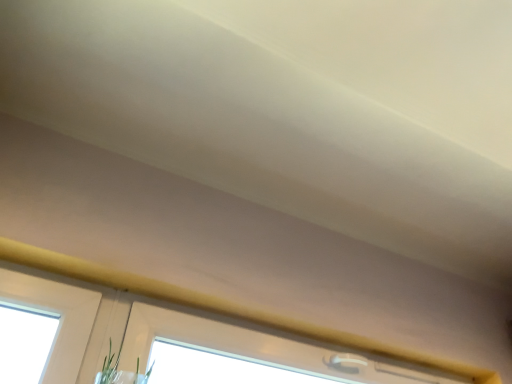
Question: From the image's perspective, is white plastic window at upper center below green matte plant at lower center?

Choices:
 (A) yes
 (B) no

Answer: (B)

Question: Does white plastic window at upper center lie behind green matte plant at lower center?

Choices:
 (A) yes
 (B) no

Answer: (A)

Question: Is white plastic window at upper center facing away from green matte plant at lower center?

Choices:
 (A) no
 (B) yes

Answer: (A)

Question: Does white plastic window at upper center have a greater height compared to green matte plant at lower center?

Choices:
 (A) yes
 (B) no

Answer: (B)

Question: Is white plastic window at upper center oriented towards green matte plant at lower center?

Choices:
 (A) yes
 (B) no

Answer: (B)

Question: Is white plastic window at upper center smaller than green matte plant at lower center?

Choices:
 (A) yes
 (B) no

Answer: (A)

Question: Is the position of green matte plant at lower center less distant than that of white plastic window at upper center?

Choices:
 (A) no
 (B) yes

Answer: (B)

Question: Can you confirm if green matte plant at lower center is taller than white plastic window at upper center?

Choices:
 (A) yes
 (B) no

Answer: (A)

Question: From a real-world perspective, is green matte plant at lower center beneath white plastic window at upper center?

Choices:
 (A) no
 (B) yes

Answer: (B)

Question: Is green matte plant at lower center to the left of white plastic window at upper center from the viewer's perspective?

Choices:
 (A) yes
 (B) no

Answer: (A)

Question: From the image's perspective, is green matte plant at lower center above white plastic window at upper center?

Choices:
 (A) yes
 (B) no

Answer: (B)

Question: Is green matte plant at lower center positioned far away from white plastic window at upper center?

Choices:
 (A) yes
 (B) no

Answer: (B)

Question: From the image's perspective, is green matte plant at lower center positioned above or below white plastic window at upper center?

Choices:
 (A) above
 (B) below

Answer: (B)